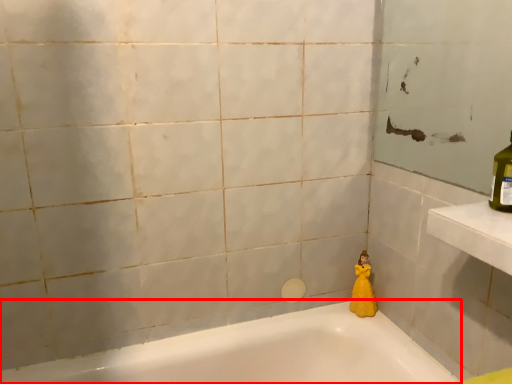
Question: From the image's perspective, what is the correct spatial positioning of bathtub (annotated by the red box) in reference to doll?

Choices:
 (A) below
 (B) above

Answer: (A)